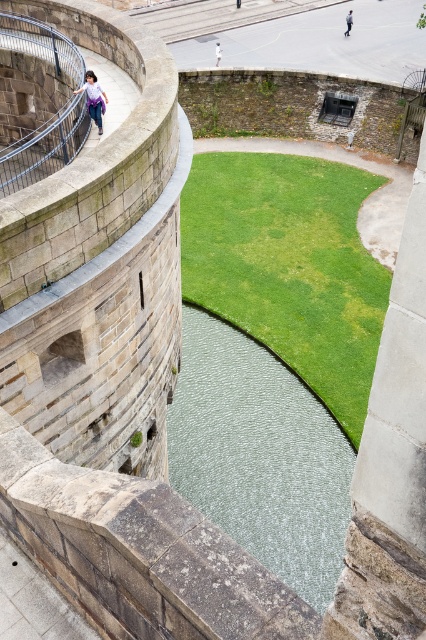
You are a security guard patrolling the historic stone structure. You notice two items, the denim pants at upper left and the white cotton shirt at upper left, lying near the curved stone wall. Which item is closer to the edge of the moat?

The denim pants at upper left is to the left of the white cotton shirt at upper left. Since the moat is located near the edge of the structure, the denim pants at upper left is closer to the edge of the moat.

You are standing at the point with coordinates point (2, 196) and want to walk to the point with coordinates point (325, 390). Given the layout of the historic stone structure and its surrounding moat, will you be able to walk directly towards your destination without crossing the moat?

Point (325, 390) is behind point (2, 196), so you can walk directly towards your destination without crossing the moat.